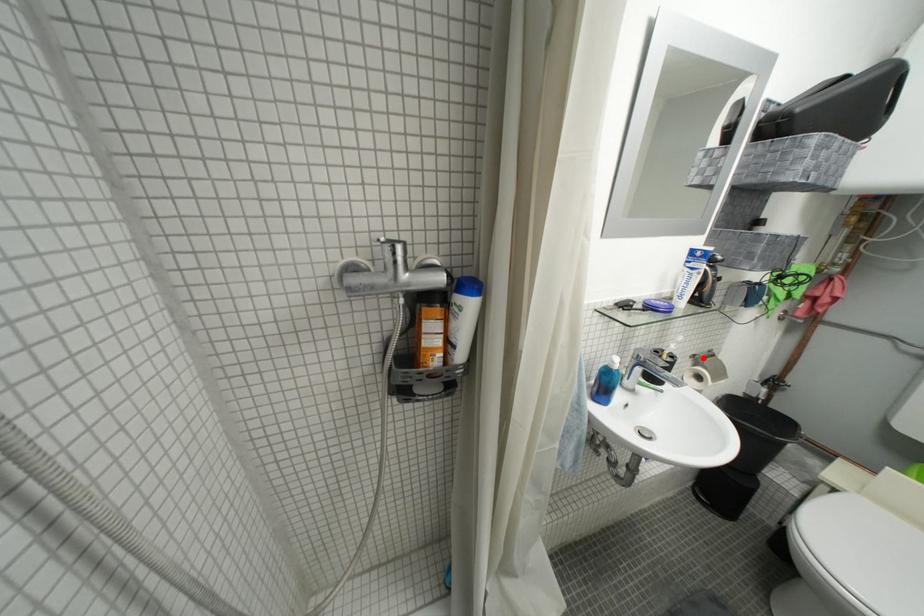
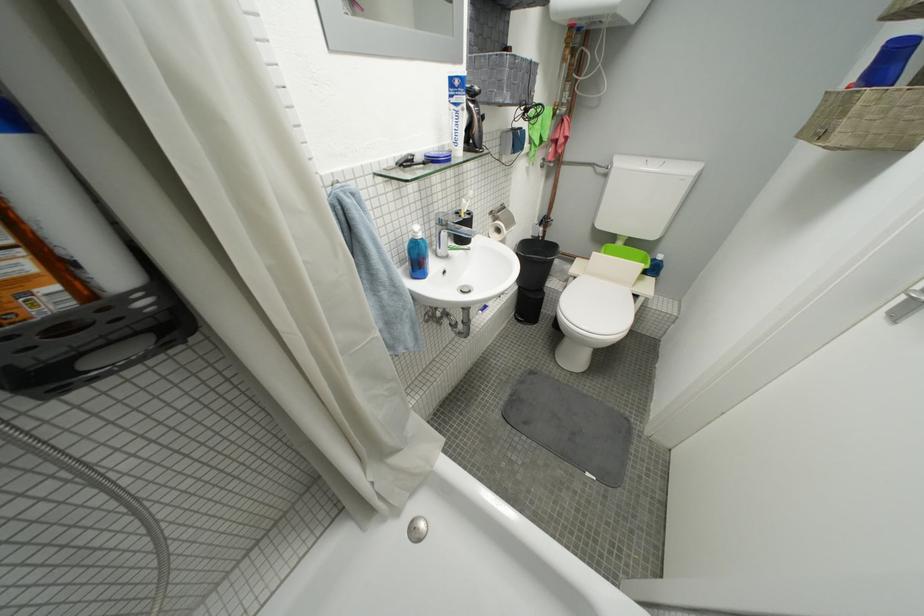
Question: I am providing you with two images of the same scene from different viewpoints. In image1, a red point is highlighted. Considering the same 3D point in image2, which of the following is correct?

Choices:
 (A) It is closer
 (B) It is farther

Answer: (A)